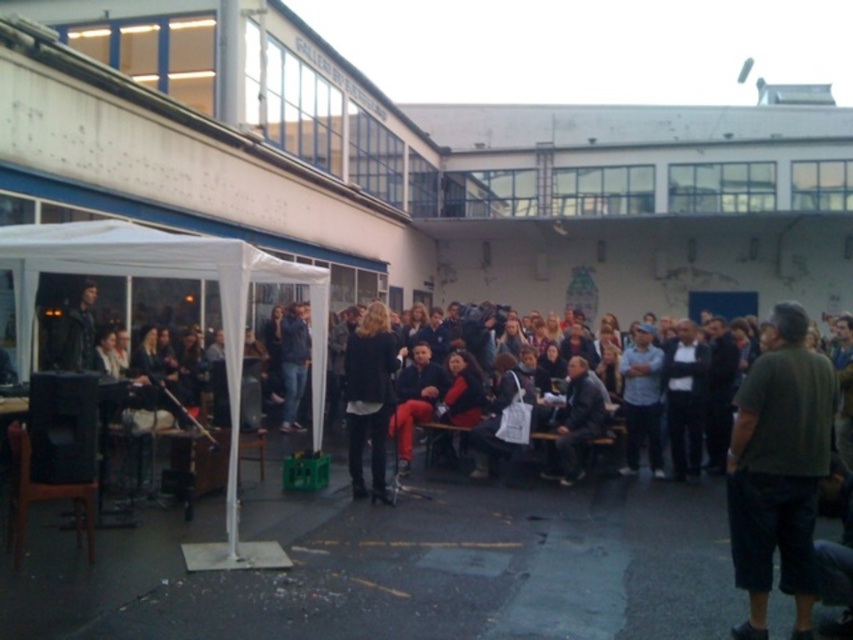
Between white fabric canopy at left and black leather jacket at center, which one is positioned lower?

black leather jacket at center is lower down.

Does point (252, 246) lie in front of point (352, 452)?

That is False.

Where is `white fabric canopy at left`? Image resolution: width=853 pixels, height=640 pixels. white fabric canopy at left is located at coordinates (173, 276).

How distant is white fabric canopy at left from dark gray suit at center?

white fabric canopy at left is 4.46 meters away from dark gray suit at center.

Does white fabric canopy at left have a greater height compared to dark gray suit at center?

In fact, white fabric canopy at left may be shorter than dark gray suit at center.

Is point (317, 444) less distant than point (577, 417)?

Yes.

You are a GUI agent. You are given a task and a screenshot of the screen. Output one action in this format:
    pyautogui.click(x=<x>, y=<y>)
    Task: Click on the white fabric canopy at left
    The image size is (853, 640).
    Given the screenshot: What is the action you would take?
    pyautogui.click(x=173, y=276)

Is matte gray shirt at center further to camera compared to dark gray suit at center?

That is True.

Which is below, matte gray shirt at center or dark gray suit at center?

dark gray suit at center is below.

Who is more distant from viewer, (x=634, y=348) or (x=556, y=432)?

Point (x=634, y=348)

Locate an element on the screen. This screenshot has width=853, height=640. matte gray shirt at center is located at coordinates (641, 400).